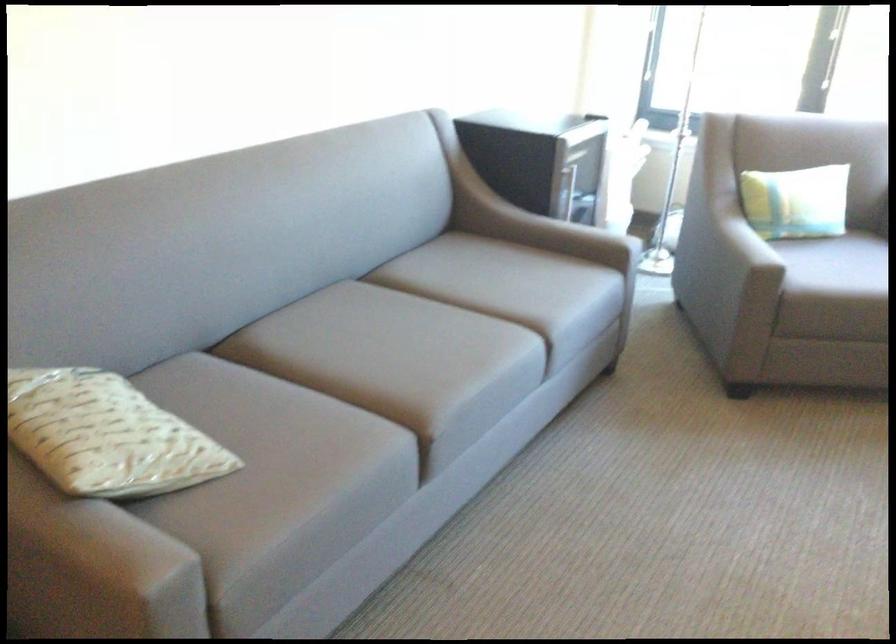
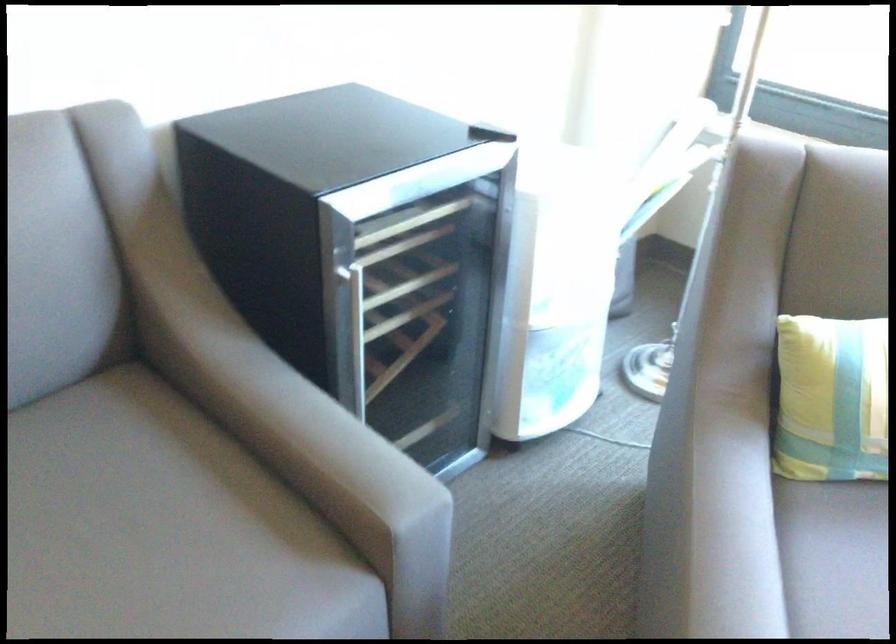
In a continuous first-person perspective shot, in which direction is the camera moving?

The movement direction of the cameraman is right, forward.